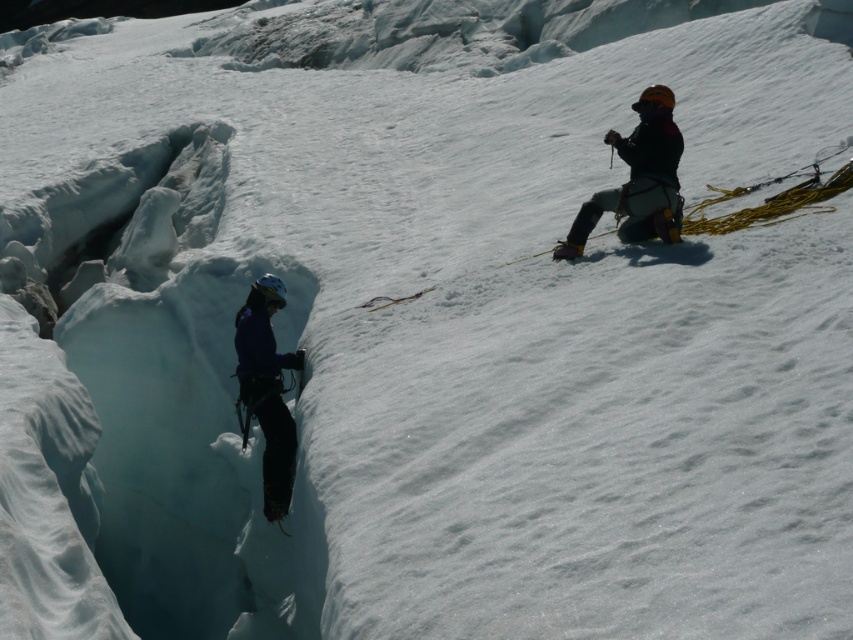
Question: Which of the following is the closest to the observer?

Choices:
 (A) dark blue fabric jacket at right
 (B) blue fabric jacket at left

Answer: (A)

Question: Is dark blue fabric jacket at right to the left of blue fabric jacket at left from the viewer's perspective?

Choices:
 (A) no
 (B) yes

Answer: (A)

Question: In this image, where is dark blue fabric jacket at right located relative to blue fabric jacket at left?

Choices:
 (A) left
 (B) right

Answer: (B)

Question: Which point is farther from the camera taking this photo?

Choices:
 (A) (645, 122)
 (B) (251, 358)

Answer: (B)

Question: Which point is farther from the camera taking this photo?

Choices:
 (A) (674, 132)
 (B) (242, 440)

Answer: (B)

Question: Does dark blue fabric jacket at right have a greater width compared to blue fabric jacket at left?

Choices:
 (A) yes
 (B) no

Answer: (A)